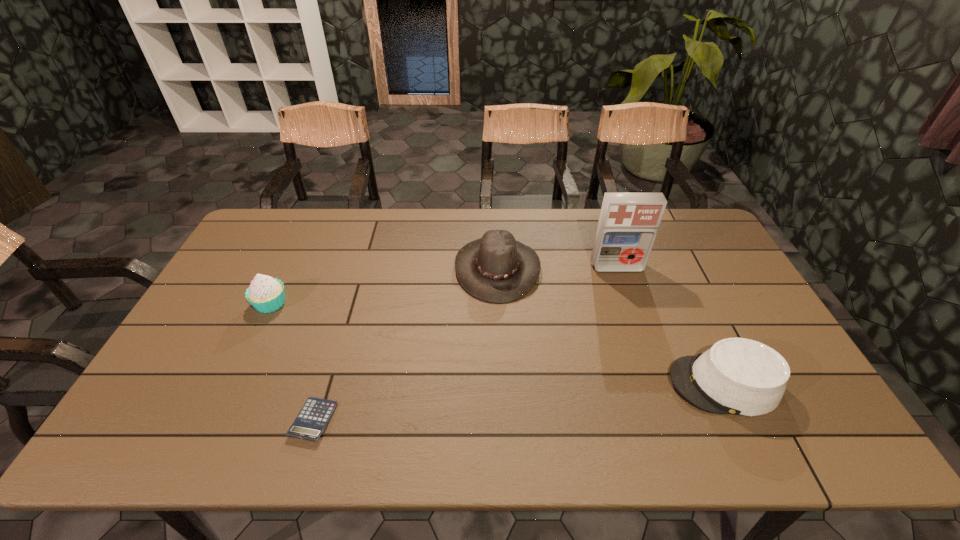
Where is `vacant space that satisfies the following two spatial constraints: 1. on the front-facing side of the tallest object; 2. on the front-facing side of the left hat`? Image resolution: width=960 pixels, height=540 pixels. vacant space that satisfies the following two spatial constraints: 1. on the front-facing side of the tallest object; 2. on the front-facing side of the left hat is located at coordinates (617, 268).